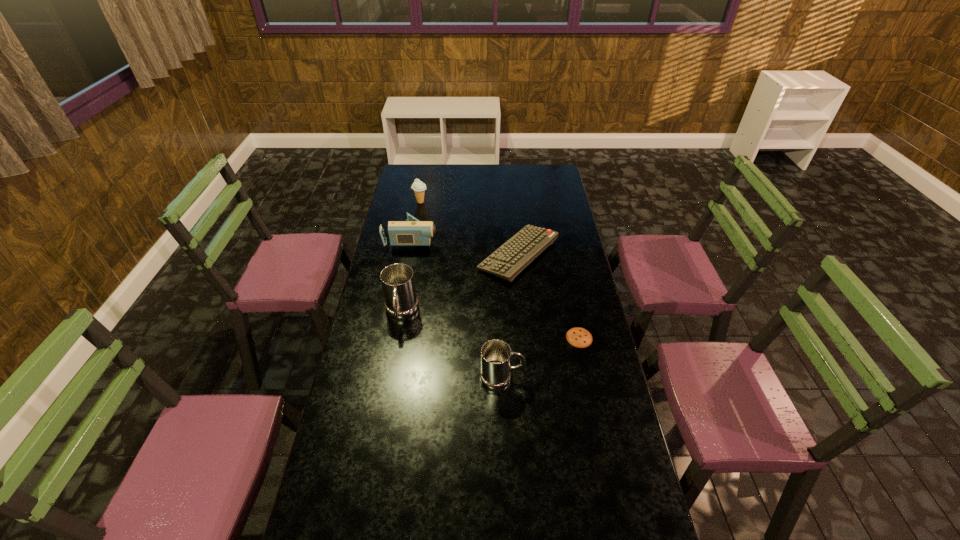
Where is `vacant place for an extra mug on the right`? This screenshot has width=960, height=540. vacant place for an extra mug on the right is located at coordinates (636, 464).